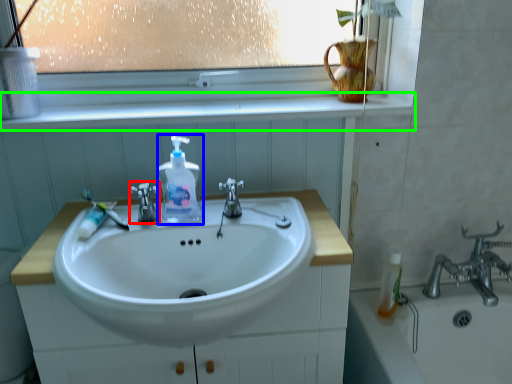
Question: Based on their relative distances, which object is nearer to tap (highlighted by a red box)? Choose from soap dispenser (highlighted by a blue box) and window sill (highlighted by a green box).

Choices:
 (A) soap dispenser
 (B) window sill

Answer: (A)